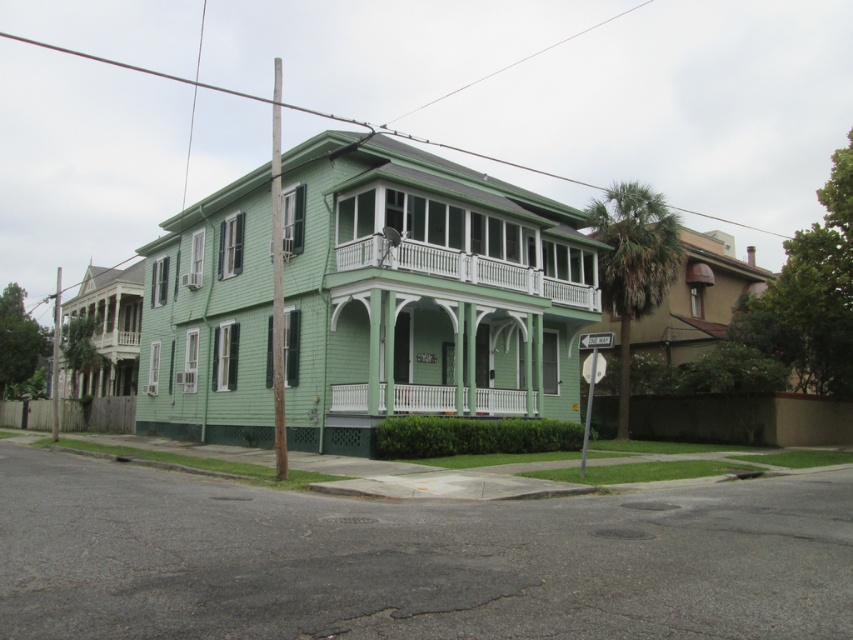
Is the position of white wooden porch at upper center more distant than that of white painted wood porch at center?

No, white wooden porch at upper center is closer to the viewer.

Does white wooden porch at upper center have a lesser height compared to white painted wood porch at center?

In fact, white wooden porch at upper center may be taller than white painted wood porch at center.

Find the location of a particular element. white wooden porch at upper center is located at coordinates (463, 269).